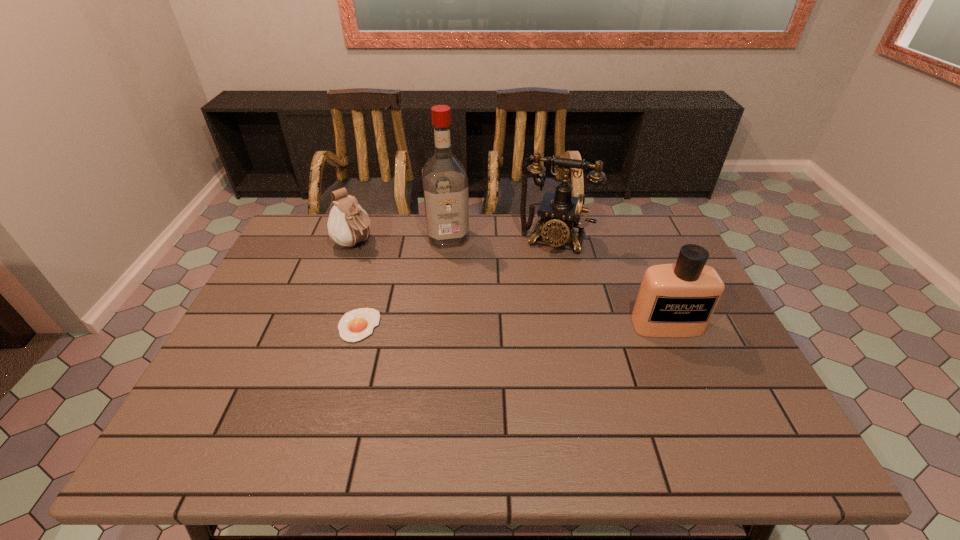
The height and width of the screenshot is (540, 960). In order to click on vacant region located on the rotary dial of the second object from right to left in this screenshot , I will do `click(542, 268)`.

Find the location of a particular element. vacant space located on the rotary dial of the second object from right to left is located at coordinates (543, 266).

Locate an element on the screen. Image resolution: width=960 pixels, height=540 pixels. vacant space located on the rotary dial of the second object from right to left is located at coordinates (536, 290).

You are a GUI agent. You are given a task and a screenshot of the screen. Output one action in this format:
    pyautogui.click(x=<x>, y=<y>)
    Task: Click on the vacant space positioned 0.150m on the front-facing side of the tallest object
    
    Given the screenshot: What is the action you would take?
    pyautogui.click(x=458, y=281)

The image size is (960, 540). What are the coordinates of `free space located on the front-facing side of the tallest object` in the screenshot? It's located at (460, 293).

Identify the location of free region located 0.360m on the front-facing side of the tallest object. (469, 335).

This screenshot has width=960, height=540. Find the location of `blank space located 0.060m on the front-facing side of the pouch`. blank space located 0.060m on the front-facing side of the pouch is located at coordinates (379, 261).

Where is `free spot located on the front-facing side of the pouch`? The image size is (960, 540). free spot located on the front-facing side of the pouch is located at coordinates (444, 304).

Find the location of a particular element. The width and height of the screenshot is (960, 540). blank space located on the front-facing side of the pouch is located at coordinates (400, 275).

The height and width of the screenshot is (540, 960). I want to click on telephone located at the far edge, so click(560, 212).